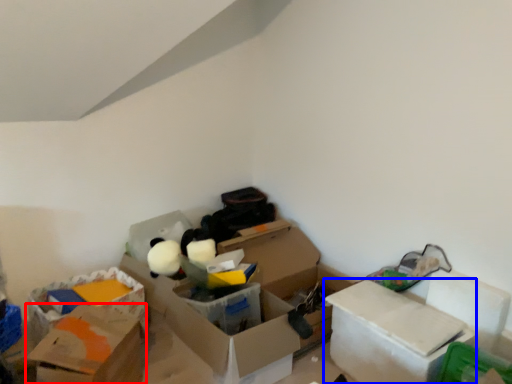
Question: Which of the following is the closest to the observer, box (highlighted by a red box) or box (highlighted by a blue box)?

Choices:
 (A) box
 (B) box

Answer: (A)